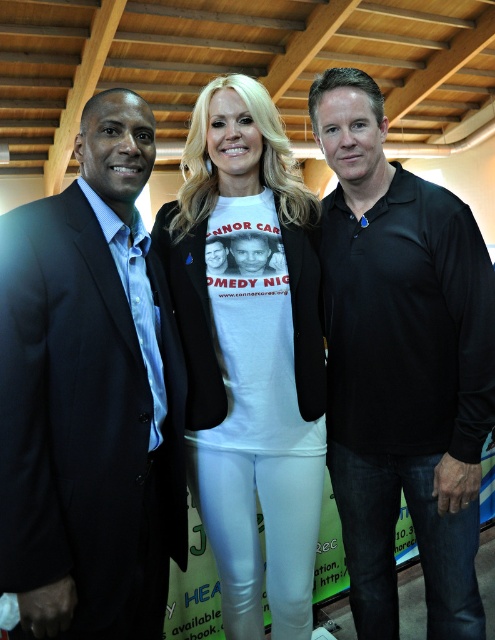
Question: Where is matte black suit at left located in relation to white matte t-shirt at center in the image?

Choices:
 (A) left
 (B) right

Answer: (A)

Question: Among these objects, which one is farthest from the camera?

Choices:
 (A) matte black suit at left
 (B) black smooth polo shirt at right

Answer: (B)

Question: Which object appears closest to the camera in this image?

Choices:
 (A) white matte t-shirt at center
 (B) matte black suit at left
 (C) black smooth polo shirt at right

Answer: (B)

Question: Can you confirm if black smooth polo shirt at right is positioned to the left of white matte t-shirt at center?

Choices:
 (A) yes
 (B) no

Answer: (B)

Question: Which object is farther from the camera taking this photo?

Choices:
 (A) white matte t-shirt at center
 (B) matte black suit at left

Answer: (A)

Question: Can you confirm if black smooth polo shirt at right is positioned to the left of white matte t-shirt at center?

Choices:
 (A) no
 (B) yes

Answer: (A)